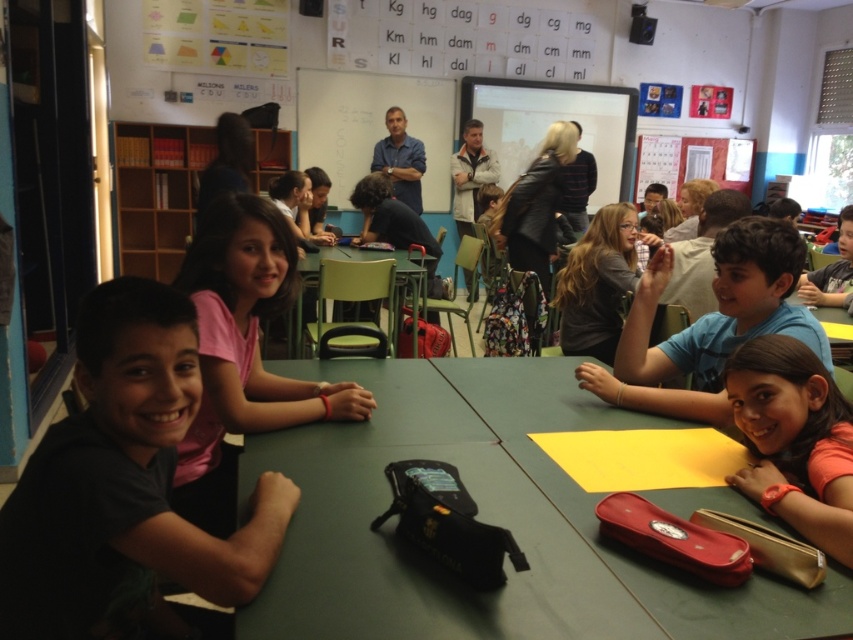
Describe the element at coordinates (793, 440) in the screenshot. I see `orange matte shirt at lower right` at that location.

Is orange matte shirt at lower right shorter than green plastic chair at center?

Yes.

This screenshot has height=640, width=853. I want to click on orange matte shirt at lower right, so click(x=793, y=440).

What do you see at coordinates (242, 352) in the screenshot? I see `pink fabric shirt at center` at bounding box center [242, 352].

Is pink fabric shirt at center closer to camera compared to orange matte shirt at lower right?

No, pink fabric shirt at center is behind orange matte shirt at lower right.

Is point (241, 252) in front of point (790, 440)?

No, it is behind (790, 440).

The width and height of the screenshot is (853, 640). Identify the location of pink fabric shirt at center. (242, 352).

Is matte black backpack at center closer to the viewer compared to matte blue shirt at center?

No.

Can you confirm if matte black backpack at center is thinner than matte blue shirt at center?

No.

At what (x,y) coordinates should I click in order to perform the action: click on matte black backpack at center. Please return your answer as a coordinate pair (x, y). Looking at the image, I should click on (393, 225).

Where is `matte black backpack at center`? The height and width of the screenshot is (640, 853). matte black backpack at center is located at coordinates (393, 225).